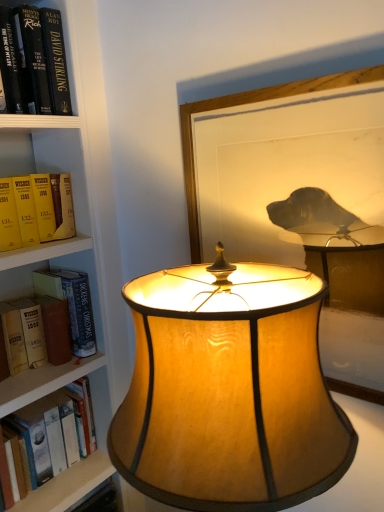
Question: Is hardcover book at left not within matte gold lampshade at center?

Choices:
 (A) yes
 (B) no

Answer: (A)

Question: Is hardcover book at left in contact with matte gold lampshade at center?

Choices:
 (A) no
 (B) yes

Answer: (A)

Question: Are hardcover book at left and matte gold lampshade at center far apart?

Choices:
 (A) no
 (B) yes

Answer: (A)

Question: Is hardcover book at left surrounding matte gold lampshade at center?

Choices:
 (A) yes
 (B) no

Answer: (B)

Question: From the image's perspective, is hardcover book at left above matte gold lampshade at center?

Choices:
 (A) yes
 (B) no

Answer: (A)

Question: Considering the relative positions of hardcover book at left and matte gold lampshade at center in the image provided, is hardcover book at left to the left of matte gold lampshade at center from the viewer's perspective?

Choices:
 (A) yes
 (B) no

Answer: (A)

Question: From the image's perspective, is hardcover book at left above hardcover book at left?

Choices:
 (A) yes
 (B) no

Answer: (A)

Question: From a real-world perspective, is hardcover book at left over hardcover book at left?

Choices:
 (A) no
 (B) yes

Answer: (B)

Question: Is hardcover book at left at the back of hardcover book at left?

Choices:
 (A) no
 (B) yes

Answer: (A)

Question: Is the position of hardcover book at left more distant than that of hardcover book at left?

Choices:
 (A) yes
 (B) no

Answer: (A)

Question: Can you confirm if hardcover book at left is shorter than hardcover book at left?

Choices:
 (A) no
 (B) yes

Answer: (A)

Question: Does hardcover book at left have a larger size compared to hardcover book at left?

Choices:
 (A) yes
 (B) no

Answer: (A)

Question: From the image's perspective, is wooden framed picture at center below hardcover book at left?

Choices:
 (A) no
 (B) yes

Answer: (A)